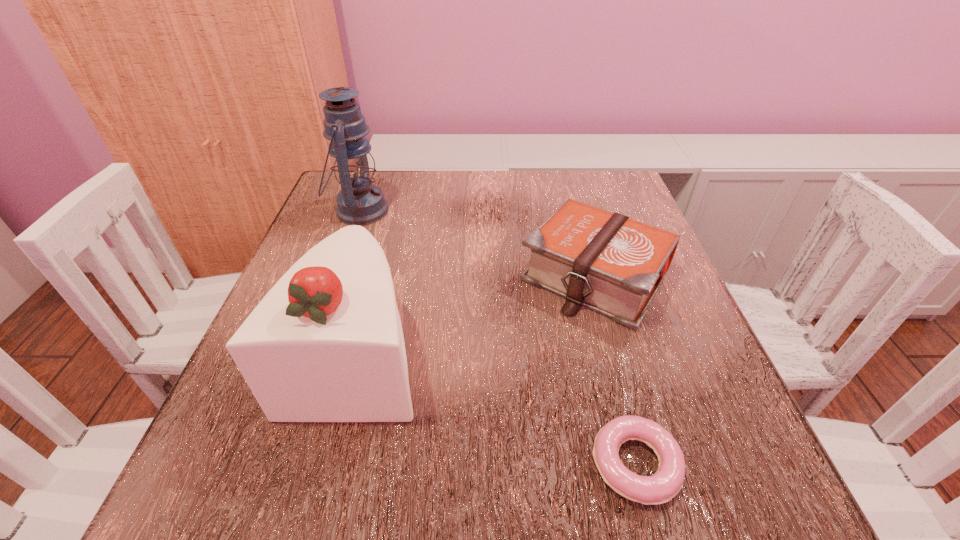
Where is `free space that satisfies the following two spatial constraints: 1. on the front-facing side of the lantern; 2. on the right side of the doughnut`? The width and height of the screenshot is (960, 540). free space that satisfies the following two spatial constraints: 1. on the front-facing side of the lantern; 2. on the right side of the doughnut is located at coordinates (268, 464).

The height and width of the screenshot is (540, 960). I want to click on vacant point that satisfies the following two spatial constraints: 1. on the front-facing side of the Bible; 2. on the left side of the lantern, so click(x=336, y=276).

Where is `blank area in the image that satisfies the following two spatial constraints: 1. on the back side of the third tallest object; 2. on the right side of the third shortest object`? blank area in the image that satisfies the following two spatial constraints: 1. on the back side of the third tallest object; 2. on the right side of the third shortest object is located at coordinates (378, 276).

The image size is (960, 540). What are the coordinates of `free space that satisfies the following two spatial constraints: 1. on the front-facing side of the third shortest object; 2. on the left side of the lantern` in the screenshot? It's located at (308, 354).

Where is `free space that satisfies the following two spatial constraints: 1. on the back side of the shortest object; 2. on the left side of the second shortest object`? This screenshot has width=960, height=540. free space that satisfies the following two spatial constraints: 1. on the back side of the shortest object; 2. on the left side of the second shortest object is located at coordinates 586,276.

At what (x,y) coordinates should I click in order to perform the action: click on vacant space that satisfies the following two spatial constraints: 1. on the front-facing side of the lantern; 2. on the right side of the second shortest object. Please return your answer as a coordinate pair (x, y). The image size is (960, 540). Looking at the image, I should click on tap(336, 276).

Identify the location of vacant area in the image that satisfies the following two spatial constraints: 1. on the back side of the second shortest object; 2. on the front-facing side of the lantern. (576, 211).

Find the location of a particular element. free space that satisfies the following two spatial constraints: 1. on the front-facing side of the lantern; 2. on the left side of the doughnut is located at coordinates (268, 464).

Find the location of `vacant space that satisfies the following two spatial constraints: 1. on the back side of the doughnut; 2. on the right side of the Bible`. vacant space that satisfies the following two spatial constraints: 1. on the back side of the doughnut; 2. on the right side of the Bible is located at coordinates (586, 276).

Find the location of a particular element. This screenshot has height=540, width=960. free location that satisfies the following two spatial constraints: 1. on the front-facing side of the third shortest object; 2. on the left side of the lantern is located at coordinates (308, 354).